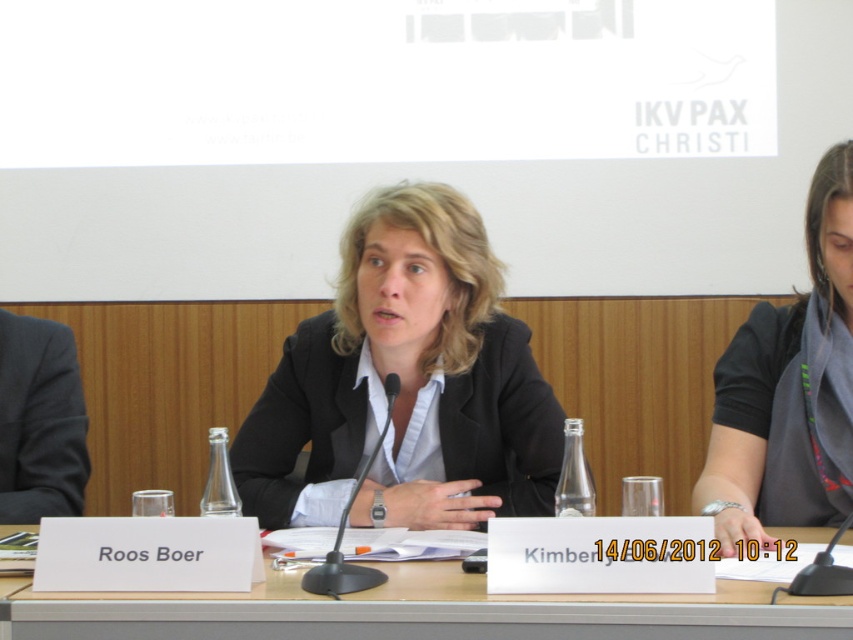
Question: Which of these objects is positioned closest to the black matte blazer at center?

Choices:
 (A) black fabric shirt at center
 (B) wooden table at center

Answer: (A)

Question: Which of the following is the closest to the observer?

Choices:
 (A) black fabric shirt at center
 (B) wooden table at center

Answer: (B)

Question: Which object is farther from the camera taking this photo?

Choices:
 (A) wooden table at center
 (B) black fabric shirt at center
 (C) black matte blazer at center

Answer: (C)

Question: Can you confirm if black matte blazer at center is positioned above black fabric shirt at center?

Choices:
 (A) yes
 (B) no

Answer: (B)

Question: Is black matte blazer at center wider than wooden table at center?

Choices:
 (A) yes
 (B) no

Answer: (B)

Question: In this image, where is black matte blazer at center located relative to wooden table at center?

Choices:
 (A) above
 (B) below

Answer: (A)